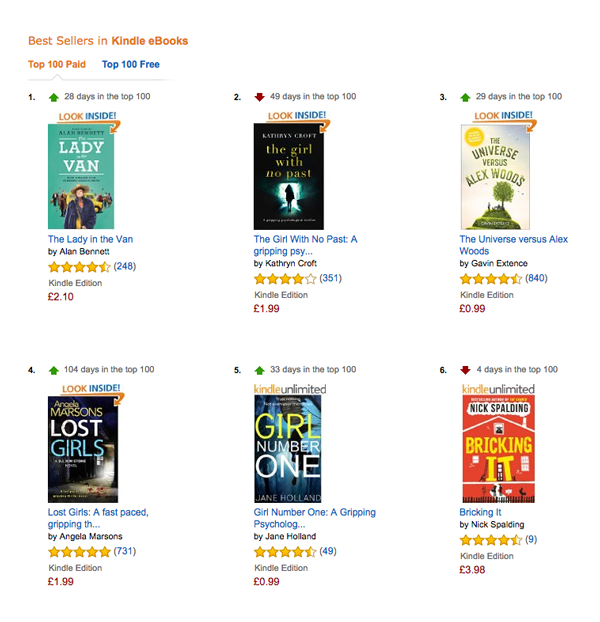
Find the location of `books in the image`. books in the image is located at coordinates (90, 160), (301, 163), (509, 170), (501, 442), (276, 442), (60, 456).